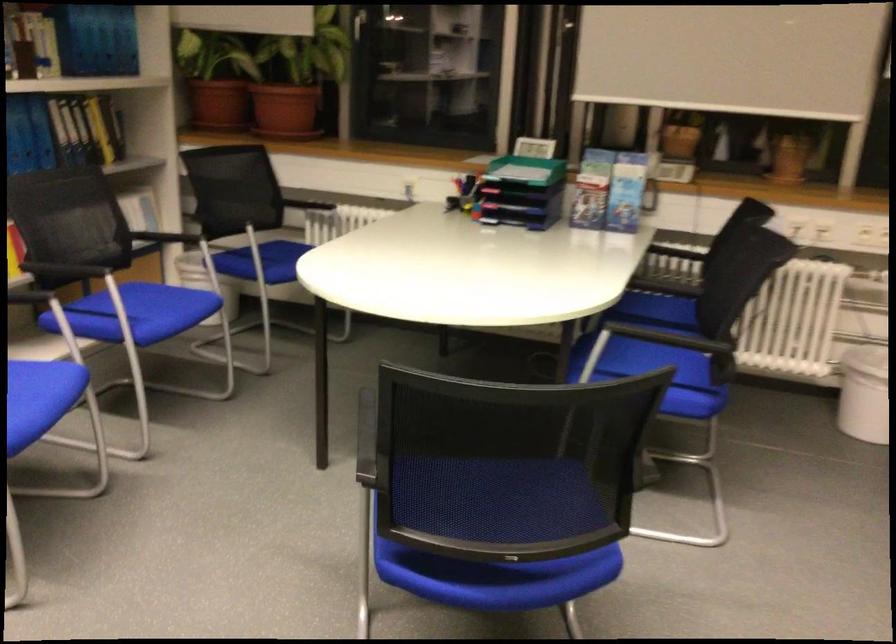
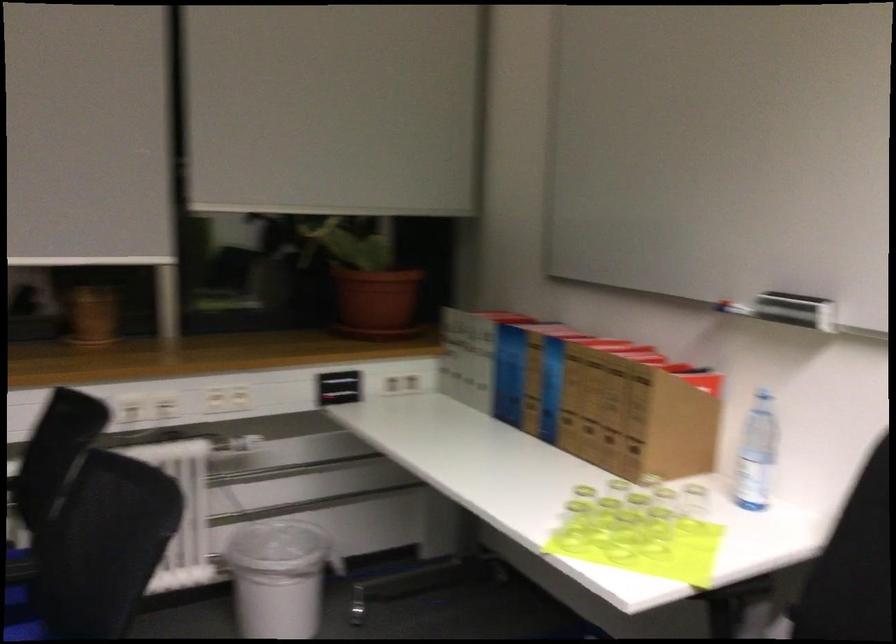
Locate, in the second image, the point that corresponds to the point at 690,321 in the first image.

(23, 603)